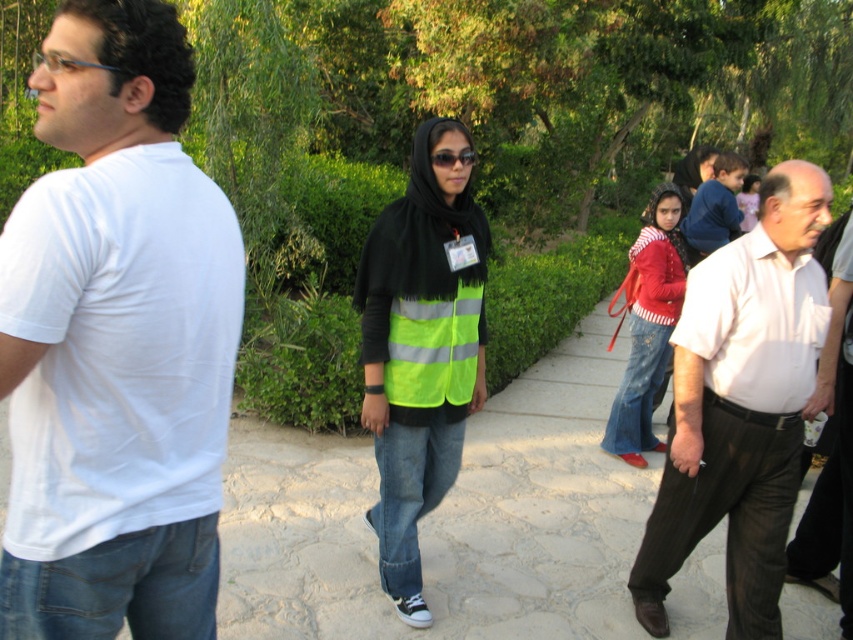
Question: Considering the real-world distances, which object is closest to the neon yellow reflective vest at center?

Choices:
 (A) reflective plastic sunglasses at center
 (B) white cotton shirt at center
 (C) white cotton t-shirt at left
 (D) red striped sweater at center

Answer: (A)

Question: Does white cotton t-shirt at left have a lesser width compared to white cotton shirt at center?

Choices:
 (A) no
 (B) yes

Answer: (B)

Question: Among these points, which one is farthest from the camera?

Choices:
 (A) (437, 157)
 (B) (51, 614)

Answer: (A)

Question: Is neon yellow reflective vest at center below reflective plastic sunglasses at center?

Choices:
 (A) yes
 (B) no

Answer: (A)

Question: Can you confirm if white cotton shirt at center is positioned above reflective plastic sunglasses at center?

Choices:
 (A) yes
 (B) no

Answer: (B)

Question: Which of the following is the farthest from the observer?

Choices:
 (A) white cotton shirt at center
 (B) red striped sweater at center
 (C) neon yellow reflective vest at center

Answer: (B)